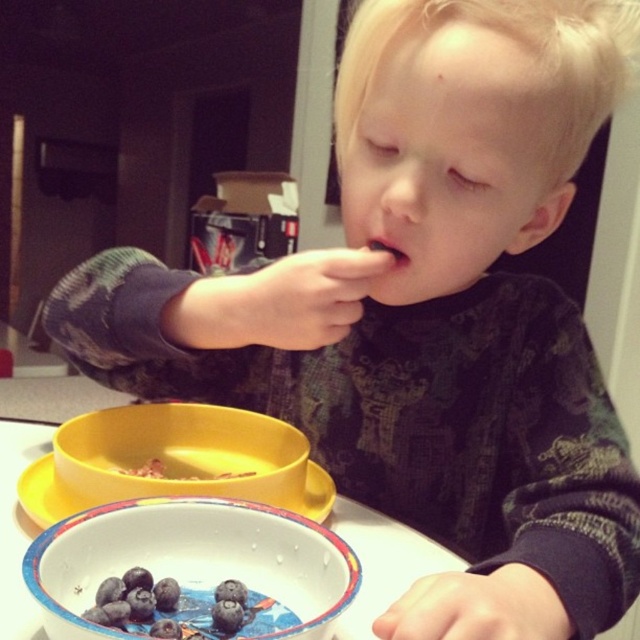
Between blueberry matte at lower left and white glossy plate at lower center, which one appears on the right side from the viewer's perspective?

From the viewer's perspective, blueberry matte at lower left appears more on the right side.

I want to click on blueberry matte at lower left, so click(x=168, y=605).

At what (x,y) coordinates should I click in order to perform the action: click on blueberry matte at lower left. Please return your answer as a coordinate pair (x, y). Looking at the image, I should click on (168, 605).

From the picture: Is white glossy table at center wider than yellow matte cereal at upper left?

Correct, the width of white glossy table at center exceeds that of yellow matte cereal at upper left.

Is white glossy table at center smaller than yellow matte cereal at upper left?

No.

Does point (20, 515) come behind point (138, 468)?

No.

The height and width of the screenshot is (640, 640). I want to click on white glossy table at center, so click(381, 563).

Does blue glossy bowl at lower center appear on the left side of white glossy plate at lower center?

In fact, blue glossy bowl at lower center is to the right of white glossy plate at lower center.

Does point (99, 545) lie behind point (24, 496)?

No, it is not.

Does point (292, 595) come behind point (307, 464)?

No, it is in front of (307, 464).

Locate an element on the screen. This screenshot has height=640, width=640. blue glossy bowl at lower center is located at coordinates (195, 563).